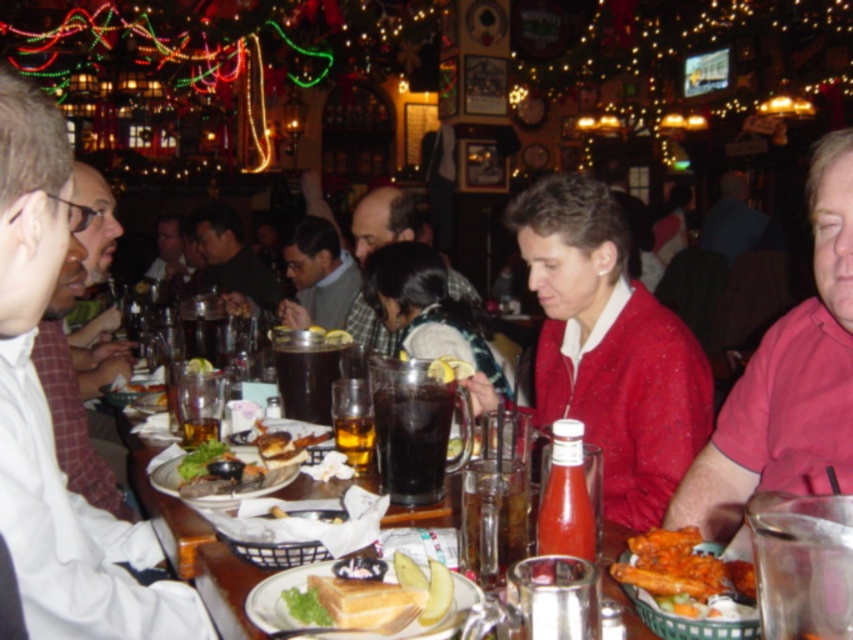
What do you see at coordinates (788, 380) in the screenshot? I see `pink cotton shirt at right` at bounding box center [788, 380].

Is point (764, 436) farther from viewer compared to point (386, 627)?

Yes.

Between point (712, 516) and point (451, 579), which one is positioned behind?

Positioned behind is point (712, 516).

Where is `pink cotton shirt at right`? This screenshot has width=853, height=640. pink cotton shirt at right is located at coordinates (788, 380).

Between point (100, 228) and point (288, 380), which one is positioned behind?

Positioned behind is point (100, 228).

Can you confirm if white plaid shirt at left is smaller than dark brown liquid at center?

Actually, white plaid shirt at left might be larger than dark brown liquid at center.

Based on the photo, who is more distant from viewer, [65,406] or [303,387]?

Point [65,406]

Image resolution: width=853 pixels, height=640 pixels. Identify the location of white plaid shirt at left. (82, 349).

Who is taller, matte black jacket at center or smooth brown leather jacket at center?

With more height is smooth brown leather jacket at center.

Is point (434, 266) farther from viewer compared to point (181, 243)?

No, it is in front of (181, 243).

In order to click on matte black jacket at center in this screenshot , I will do `click(421, 296)`.